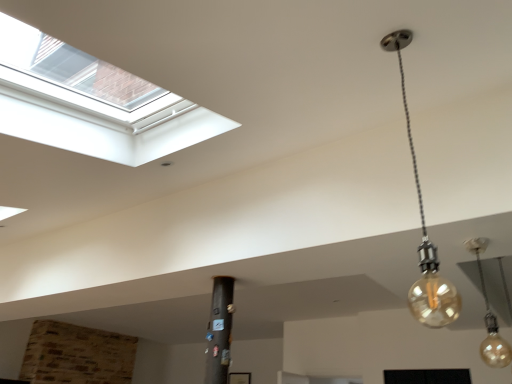
Question: From the image's perspective, would you say translucent glass bulb at lower right, which is the 2th lamp in top-to-bottom order, is positioned over translucent amber bulb at upper right, the first lamp viewed from the left?

Choices:
 (A) yes
 (B) no

Answer: (B)

Question: Is the position of translucent glass bulb at lower right, marked as the second lamp in a front-to-back arrangement, more distant than that of translucent amber bulb at upper right, which ranks as the 2th lamp in back-to-front order?

Choices:
 (A) yes
 (B) no

Answer: (A)

Question: Is translucent amber bulb at upper right, the first lamp viewed from the left, surrounded by translucent glass bulb at lower right, marked as the second lamp in a front-to-back arrangement?

Choices:
 (A) yes
 (B) no

Answer: (B)

Question: Does translucent glass bulb at lower right, the first lamp in the back-to-front sequence, appear on the left side of translucent amber bulb at upper right, which ranks as the 2th lamp in back-to-front order?

Choices:
 (A) yes
 (B) no

Answer: (B)

Question: Considering the relative sizes of translucent glass bulb at lower right, which is the first lamp in bottom-to-top order, and translucent amber bulb at upper right, the second lamp when ordered from right to left, in the image provided, is translucent glass bulb at lower right, which is the first lamp in bottom-to-top order, taller than translucent amber bulb at upper right, the second lamp when ordered from right to left,?

Choices:
 (A) no
 (B) yes

Answer: (A)

Question: Is translucent glass bulb at lower right, which is the second lamp from left to right, oriented away from translucent amber bulb at upper right, the first lamp viewed from the left?

Choices:
 (A) no
 (B) yes

Answer: (A)

Question: Considering the relative sizes of translucent amber bulb at upper right, marked as the second lamp in a bottom-to-top arrangement, and translucent glass bulb at lower right, the first lamp in the back-to-front sequence, in the image provided, is translucent amber bulb at upper right, marked as the second lamp in a bottom-to-top arrangement, wider than translucent glass bulb at lower right, the first lamp in the back-to-front sequence,?

Choices:
 (A) yes
 (B) no

Answer: (A)

Question: From a real-world perspective, is translucent amber bulb at upper right, the first lamp viewed from the left, beneath translucent glass bulb at lower right, which is the first lamp in bottom-to-top order?

Choices:
 (A) yes
 (B) no

Answer: (B)

Question: Does translucent amber bulb at upper right, marked as the first lamp in a front-to-back arrangement, appear on the left side of translucent glass bulb at lower right, the first lamp in the back-to-front sequence?

Choices:
 (A) yes
 (B) no

Answer: (A)

Question: Is translucent amber bulb at upper right, the first lamp when ordered from top to bottom, placed right next to translucent glass bulb at lower right, marked as the second lamp in a front-to-back arrangement?

Choices:
 (A) yes
 (B) no

Answer: (B)

Question: Is there a large distance between translucent amber bulb at upper right, the second lamp when ordered from right to left, and translucent glass bulb at lower right, the first lamp in the back-to-front sequence?

Choices:
 (A) yes
 (B) no

Answer: (A)

Question: From the image's perspective, is translucent amber bulb at upper right, marked as the first lamp in a front-to-back arrangement, beneath translucent glass bulb at lower right, which is the first lamp in bottom-to-top order?

Choices:
 (A) no
 (B) yes

Answer: (A)

Question: In terms of size, does translucent glass bulb at lower right, acting as the 1th lamp starting from the right, appear bigger or smaller than translucent amber bulb at upper right, marked as the first lamp in a front-to-back arrangement?

Choices:
 (A) small
 (B) big

Answer: (A)